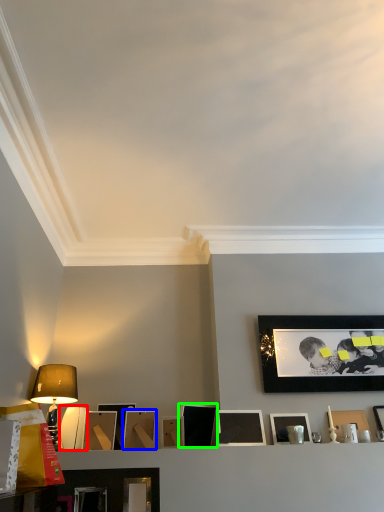
Question: Which is nearer to the picture frame (highlighted by a red box)? picture frame (highlighted by a blue box) or picture frame (highlighted by a green box).

Choices:
 (A) picture frame
 (B) picture frame

Answer: (A)